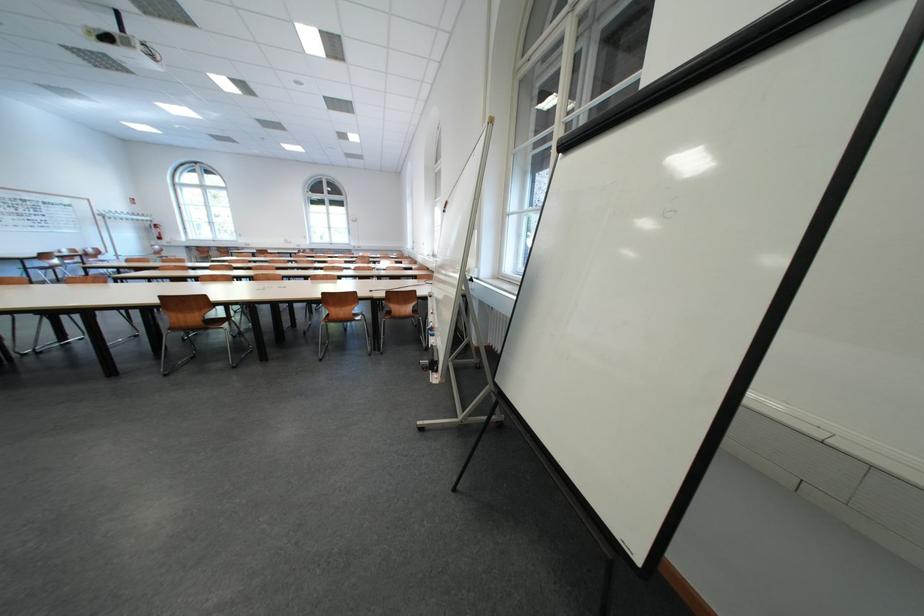
The image size is (924, 616). Describe the element at coordinates (430, 359) in the screenshot. I see `the black paper clamp` at that location.